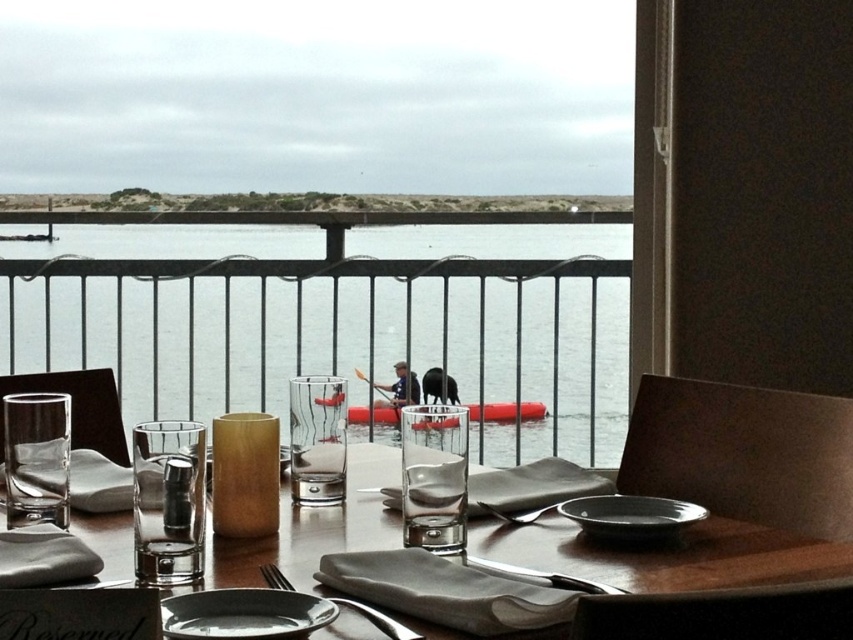
Question: Estimate the real-world distances between objects in this image. Which object is farther from the transparent water at center?

Choices:
 (A) matte glassware at center
 (B) matte black plate at center
 (C) satin silver fork at lower center
 (D) matte white plate at center

Answer: (D)

Question: Is transparent water at center positioned in front of satin silver fork at lower center?

Choices:
 (A) yes
 (B) no

Answer: (B)

Question: Considering the real-world distances, which object is farthest from the satin silver fork at lower center?

Choices:
 (A) transparent water at center
 (B) matte white plate at center

Answer: (A)

Question: Is matte glassware at center behind matte black plate at center?

Choices:
 (A) no
 (B) yes

Answer: (A)

Question: Which point is closer to the camera?

Choices:
 (A) satin silver fork at lower center
 (B) matte white plate at center

Answer: (B)

Question: Can you confirm if matte glassware at center is smaller than matte black plate at center?

Choices:
 (A) yes
 (B) no

Answer: (B)